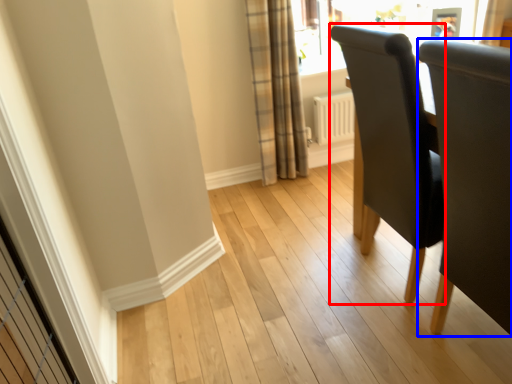
Question: Among these objects, which one is farthest to the camera, chair (highlighted by a red box) or chair (highlighted by a blue box)?

Choices:
 (A) chair
 (B) chair

Answer: (A)